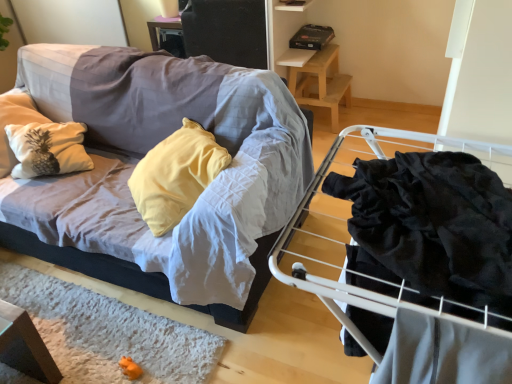
Question: Looking at their shapes, would you say textured fabric couch at left is wider or thinner than black velvet fabric at right?

Choices:
 (A) thin
 (B) wide

Answer: (B)

Question: In the image, is textured fabric couch at left positioned in front of or behind black velvet fabric at right?

Choices:
 (A) front
 (B) behind

Answer: (B)

Question: Which of these objects is positioned closest to the textured fabric couch at left?

Choices:
 (A) wooden stool at upper right
 (B) black velvet fabric at right

Answer: (B)

Question: Which is nearer to the wooden stool at upper right?

Choices:
 (A) black velvet fabric at right
 (B) textured fabric couch at left

Answer: (B)